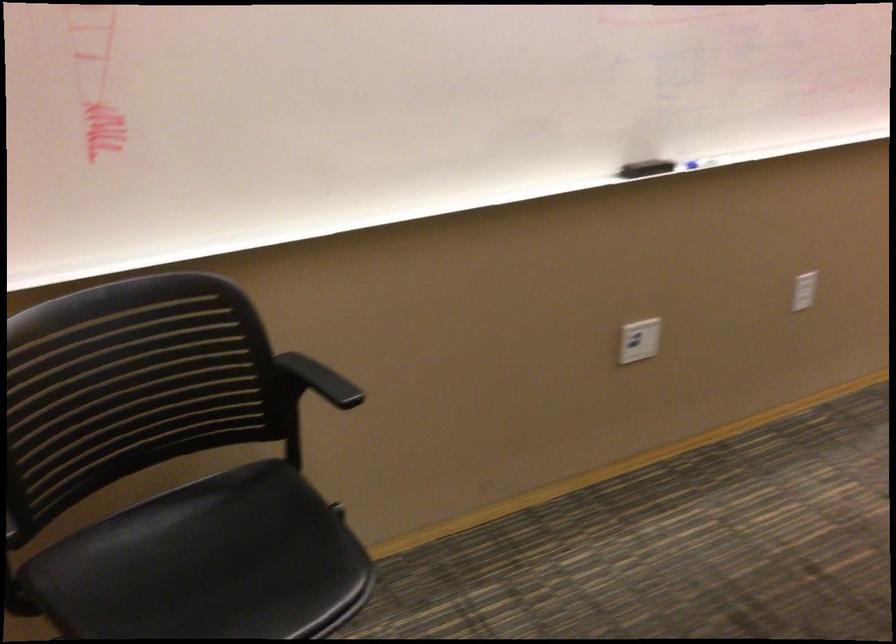
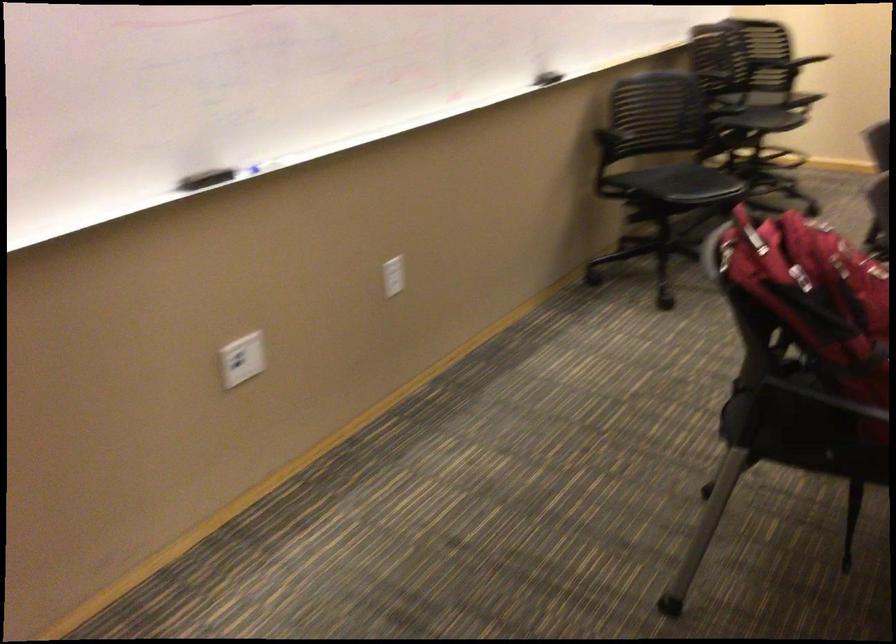
Locate, in the second image, the point that corresponds to pixel 636 337 in the first image.

(242, 359)